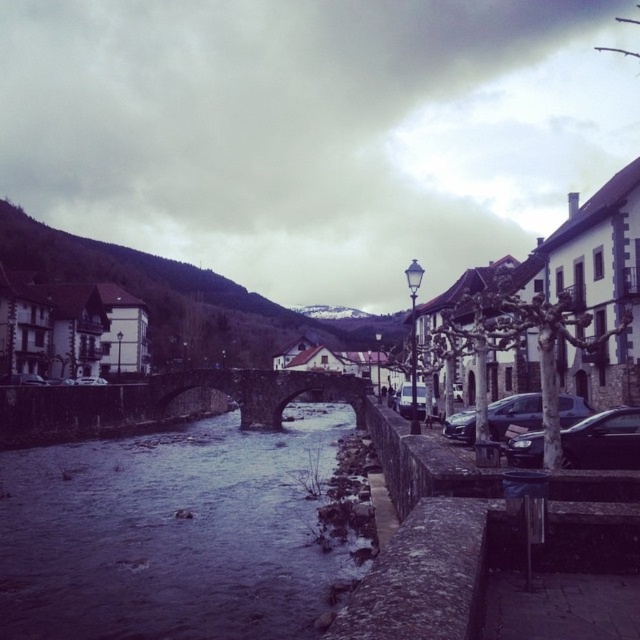
Question: Can you confirm if dark stone bridge at center is smaller than satin silver sedan at center?

Choices:
 (A) yes
 (B) no

Answer: (B)

Question: Does dark gray metallic car at center right appear on the right side of satin silver sedan at center?

Choices:
 (A) no
 (B) yes

Answer: (B)

Question: Which object is closer to the camera taking this photo?

Choices:
 (A) matte white building at left
 (B) dark gray stone river at center

Answer: (B)

Question: Is dark gray stone river at center below satin silver sedan at center?

Choices:
 (A) yes
 (B) no

Answer: (A)

Question: Based on their relative distances, which object is farther from the shiny black sedan at center right?

Choices:
 (A) dark stone bridge at center
 (B) dark gray metallic car at center right

Answer: (A)

Question: Which point is closer to the camera?

Choices:
 (A) dark gray metallic car at center right
 (B) satin silver sedan at center
 (C) matte white building at left

Answer: (A)